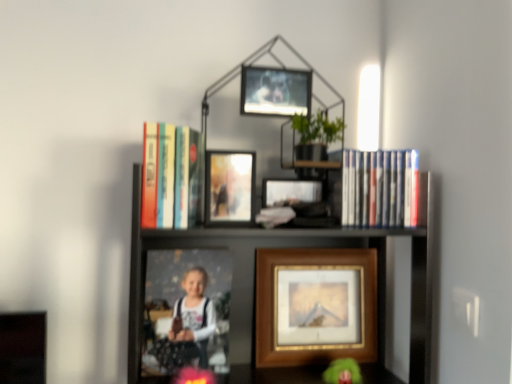
Question: Would you consider metallic silver picture frame at upper center, marked as the 1th picture frame in a top-to-bottom arrangement, to be distant from wooden framed print at center, arranged as the 1th picture frame when ordered from the bottom?

Choices:
 (A) yes
 (B) no

Answer: (B)

Question: Is metallic silver picture frame at upper center, positioned as the 2th picture frame in front-to-back order, outside wooden framed print at center, arranged as the 1th picture frame when ordered from the bottom?

Choices:
 (A) yes
 (B) no

Answer: (A)

Question: Is metallic silver picture frame at upper center, positioned as the 2th picture frame in front-to-back order, to the left of wooden framed print at center, which is the first picture frame from back to front, from the viewer's perspective?

Choices:
 (A) no
 (B) yes

Answer: (B)

Question: Considering the relative positions of metallic silver picture frame at upper center, the fourth picture frame when ordered from bottom to top, and wooden framed print at center, which is the first picture frame from back to front, in the image provided, is metallic silver picture frame at upper center, the fourth picture frame when ordered from bottom to top, to the right of wooden framed print at center, which is the first picture frame from back to front, from the viewer's perspective?

Choices:
 (A) no
 (B) yes

Answer: (A)

Question: Does metallic silver picture frame at upper center, marked as the 1th picture frame in a top-to-bottom arrangement, have a larger size compared to wooden framed print at center, arranged as the 1th picture frame when ordered from the bottom?

Choices:
 (A) yes
 (B) no

Answer: (B)

Question: Is metallic silver picture frame at upper center, positioned as the 2th picture frame in front-to-back order, thinner than wooden framed print at center, which is the first picture frame from back to front?

Choices:
 (A) yes
 (B) no

Answer: (A)

Question: Can you confirm if hardcover books at upper center, which appears as the first book when viewed from the left, is thinner than metallic silver picture frame at upper center, positioned as the 2th picture frame in front-to-back order?

Choices:
 (A) yes
 (B) no

Answer: (B)

Question: Is hardcover books at upper center, acting as the second book starting from the right, positioned beyond the bounds of metallic silver picture frame at upper center, marked as the 1th picture frame in a top-to-bottom arrangement?

Choices:
 (A) no
 (B) yes

Answer: (B)

Question: From a real-world perspective, is hardcover books at upper center, which appears as the first book when viewed from the left, on metallic silver picture frame at upper center, marked as the 1th picture frame in a top-to-bottom arrangement?

Choices:
 (A) no
 (B) yes

Answer: (A)

Question: Is hardcover books at upper center, acting as the second book starting from the right, in front of metallic silver picture frame at upper center, positioned as the 2th picture frame in front-to-back order?

Choices:
 (A) yes
 (B) no

Answer: (A)

Question: From the image's perspective, is hardcover books at upper center, acting as the second book starting from the right, beneath metallic silver picture frame at upper center, the fourth picture frame when ordered from bottom to top?

Choices:
 (A) no
 (B) yes

Answer: (B)

Question: Is hardcover books at upper center, acting as the second book starting from the right, oriented towards metallic silver picture frame at upper center, positioned as the 2th picture frame in front-to-back order?

Choices:
 (A) no
 (B) yes

Answer: (A)

Question: Is matte plastic photo frame at center, which is counted as the second picture frame, starting from the back, at the right side of hardcover books at upper center, acting as the second book starting from the right?

Choices:
 (A) no
 (B) yes

Answer: (B)